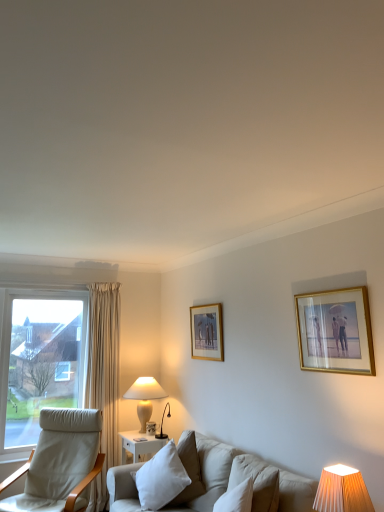
Question: Can you confirm if white ceramic table lamp at lower left, the first table lamp in the back-to-front sequence, is shorter than orange pleated fabric lampshade at lower right, which is the second table lamp from back to front?

Choices:
 (A) no
 (B) yes

Answer: (A)

Question: Considering the relative sizes of white ceramic table lamp at lower left, the first table lamp in the back-to-front sequence, and orange pleated fabric lampshade at lower right, which is the second table lamp from back to front, in the image provided, is white ceramic table lamp at lower left, the first table lamp in the back-to-front sequence, taller than orange pleated fabric lampshade at lower right, which is the second table lamp from back to front,?

Choices:
 (A) yes
 (B) no

Answer: (A)

Question: Is white ceramic table lamp at lower left, the 2th table lamp when ordered from right to left, positioned in front of orange pleated fabric lampshade at lower right, acting as the second table lamp starting from the left?

Choices:
 (A) yes
 (B) no

Answer: (B)

Question: From a real-world perspective, is white ceramic table lamp at lower left, placed as the 1th table lamp when sorted from left to right, positioned under orange pleated fabric lampshade at lower right, which is the second table lamp from back to front, based on gravity?

Choices:
 (A) no
 (B) yes

Answer: (A)

Question: From the image's perspective, is white ceramic table lamp at lower left, the 2th table lamp viewed from the front, below orange pleated fabric lampshade at lower right, which is the second table lamp from back to front?

Choices:
 (A) yes
 (B) no

Answer: (A)

Question: Considering the relative positions of wooden picture frame at center, which is the 1th picture frame from left to right, and light beige fabric chair at left in the image provided, is wooden picture frame at center, which is the 1th picture frame from left to right, to the left or to the right of light beige fabric chair at left?

Choices:
 (A) right
 (B) left

Answer: (A)

Question: In terms of width, does wooden picture frame at center, the first picture frame from the back, look wider or thinner when compared to light beige fabric chair at left?

Choices:
 (A) wide
 (B) thin

Answer: (B)

Question: Considering the positions of wooden picture frame at center, placed as the second picture frame when sorted from front to back, and light beige fabric chair at left in the image, is wooden picture frame at center, placed as the second picture frame when sorted from front to back, bigger or smaller than light beige fabric chair at left?

Choices:
 (A) small
 (B) big

Answer: (A)

Question: Is point (203, 337) positioned closer to the camera than point (99, 461)?

Choices:
 (A) farther
 (B) closer

Answer: (B)

Question: From a real-world perspective, relative to white ceramic table lamp at lower left, the 2th table lamp when ordered from right to left, is white soft cushion at center vertically above or below?

Choices:
 (A) below
 (B) above

Answer: (A)

Question: Looking at their shapes, would you say white soft cushion at center is wider or thinner than white ceramic table lamp at lower left, the 2th table lamp when ordered from right to left?

Choices:
 (A) wide
 (B) thin

Answer: (A)

Question: Considering the positions of white soft cushion at center and white ceramic table lamp at lower left, the 2th table lamp when ordered from right to left, in the image, is white soft cushion at center bigger or smaller than white ceramic table lamp at lower left, the 2th table lamp when ordered from right to left,?

Choices:
 (A) big
 (B) small

Answer: (A)

Question: Is white soft cushion at center taller or shorter than white ceramic table lamp at lower left, the 2th table lamp when ordered from right to left?

Choices:
 (A) short
 (B) tall

Answer: (A)

Question: Looking at their shapes, would you say white ceramic table lamp at lower left, the 2th table lamp when ordered from right to left, is wider or thinner than gold-framed picture at upper right, acting as the 2th picture frame starting from the back?

Choices:
 (A) wide
 (B) thin

Answer: (A)

Question: Which is correct: white ceramic table lamp at lower left, the first table lamp in the back-to-front sequence, is inside gold-framed picture at upper right, acting as the 2th picture frame starting from the back, or outside of it?

Choices:
 (A) inside
 (B) outside

Answer: (B)